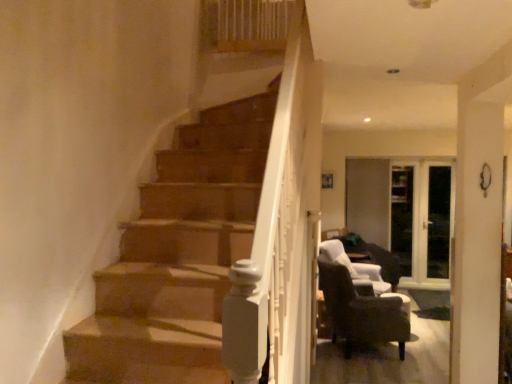
Question: Can we say transparent glass door at right, which is the first glass door in right-to-left order, lies outside dark brown leather armchair at lower right, the 1th chair in the front-to-back sequence?

Choices:
 (A) yes
 (B) no

Answer: (A)

Question: Is transparent glass door at right, which is the first glass door in right-to-left order, touching dark brown leather armchair at lower right, the 1th chair in the front-to-back sequence?

Choices:
 (A) yes
 (B) no

Answer: (B)

Question: Is dark brown leather armchair at lower right, the 1th chair in the front-to-back sequence, surrounded by transparent glass door at right, which is the first glass door in right-to-left order?

Choices:
 (A) yes
 (B) no

Answer: (B)

Question: Considering the relative sizes of transparent glass door at right, which is the first glass door in right-to-left order, and dark brown leather armchair at lower right, arranged as the second chair when viewed from the back, in the image provided, is transparent glass door at right, which is the first glass door in right-to-left order, wider than dark brown leather armchair at lower right, arranged as the second chair when viewed from the back,?

Choices:
 (A) yes
 (B) no

Answer: (B)

Question: From the image's perspective, is transparent glass door at right, which is the first glass door in right-to-left order, on top of dark brown leather armchair at lower right, the 1th chair in the front-to-back sequence?

Choices:
 (A) no
 (B) yes

Answer: (B)

Question: Is transparent glass door at right, which is the first glass door in right-to-left order, bigger than dark brown leather armchair at lower right, arranged as the second chair when viewed from the back?

Choices:
 (A) yes
 (B) no

Answer: (B)

Question: From the image's perspective, is dark brown leather chair at lower right, which is the second chair from front to back, beneath transparent glass door at right, which is the first glass door in right-to-left order?

Choices:
 (A) no
 (B) yes

Answer: (B)

Question: Does dark brown leather chair at lower right, placed as the first chair when sorted from back to front, have a smaller size compared to transparent glass door at right, which is the first glass door in right-to-left order?

Choices:
 (A) yes
 (B) no

Answer: (B)

Question: Can you confirm if dark brown leather chair at lower right, which is the second chair from front to back, is bigger than transparent glass door at right, which is the first glass door in right-to-left order?

Choices:
 (A) no
 (B) yes

Answer: (B)

Question: Considering the relative sizes of dark brown leather chair at lower right, which is the second chair from front to back, and transparent glass door at right, positioned as the second glass door in left-to-right order, in the image provided, is dark brown leather chair at lower right, which is the second chair from front to back, wider than transparent glass door at right, positioned as the second glass door in left-to-right order,?

Choices:
 (A) yes
 (B) no

Answer: (A)

Question: Is dark brown leather chair at lower right, placed as the first chair when sorted from back to front, not near transparent glass door at right, positioned as the second glass door in left-to-right order?

Choices:
 (A) yes
 (B) no

Answer: (A)

Question: Considering the relative positions of dark brown leather chair at lower right, placed as the first chair when sorted from back to front, and transparent glass door at right, which is the first glass door in right-to-left order, in the image provided, is dark brown leather chair at lower right, placed as the first chair when sorted from back to front, to the right of transparent glass door at right, which is the first glass door in right-to-left order, from the viewer's perspective?

Choices:
 (A) no
 (B) yes

Answer: (A)

Question: Does transparent glass door at center, which is counted as the 1th glass door, starting from the left, lie in front of dark brown leather armchair at lower right, the 1th chair in the front-to-back sequence?

Choices:
 (A) yes
 (B) no

Answer: (B)